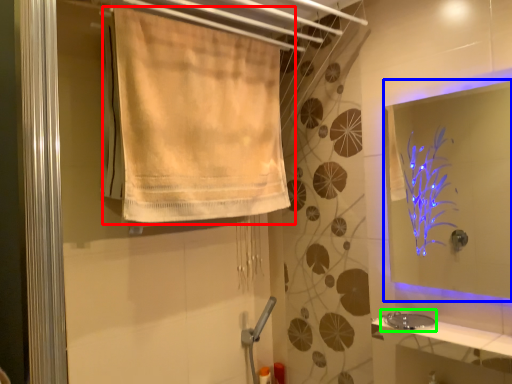
Question: Which object is positioned closest to curtain (highlighted by a red box)? Select from mirror (highlighted by a blue box) and sink (highlighted by a green box).

Choices:
 (A) mirror
 (B) sink

Answer: (B)